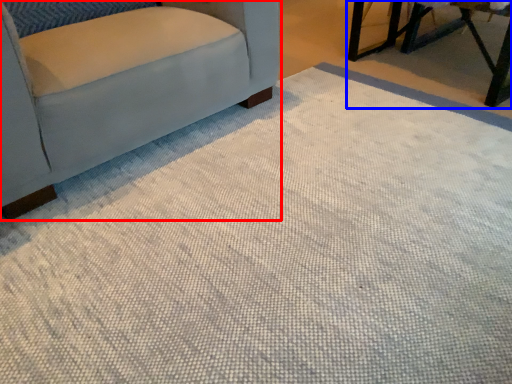
Question: Which point is further to the camera, chair (highlighted by a red box) or table (highlighted by a blue box)?

Choices:
 (A) chair
 (B) table

Answer: (B)